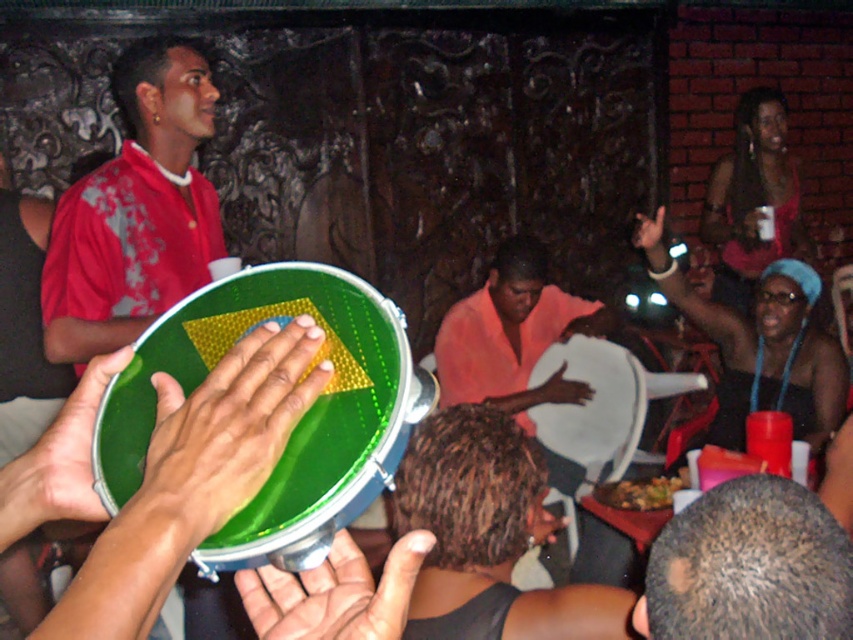
You are a musician preparing to play a song that requires both a green rubber drum at center and a matte black tambourine at center. If you need to place them side by side on a shelf that can only hold items with a combined width of 60 cm, can you fit both?

The green rubber drum at center has a smaller width than the matte black tambourine at center. However, without knowing their exact widths, it is impossible to determine if their combined total is under 60 cm.